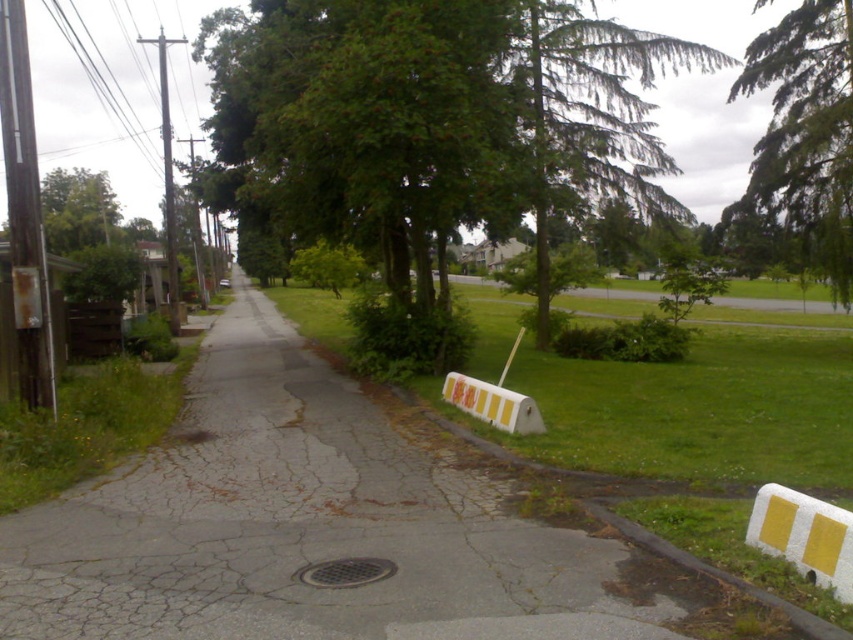
Question: Where is green leafy tree at upper center located in relation to yellow matte barricade at center in the image?

Choices:
 (A) below
 (B) above

Answer: (B)

Question: Which object appears closest to the camera in this image?

Choices:
 (A) white/yellow striped barricade at lower right
 (B) green grass at center
 (C) green leafy tree at upper center
 (D) yellow matte barricade at center

Answer: (A)

Question: Can you confirm if green leafy tree at center is positioned to the right of green grass at center?

Choices:
 (A) yes
 (B) no

Answer: (B)

Question: Which is nearer to the green grass at center?

Choices:
 (A) white/yellow striped barricade at lower right
 (B) green leafy tree at center
 (C) yellow matte barricade at center

Answer: (A)

Question: Among these points, which one is nearest to the camera?

Choices:
 (A) (811, 442)
 (B) (813, 218)
 (C) (322, 164)
 (D) (532, 417)

Answer: (A)

Question: Is green leafy tree at center thinner than white/yellow striped barricade at lower right?

Choices:
 (A) yes
 (B) no

Answer: (B)